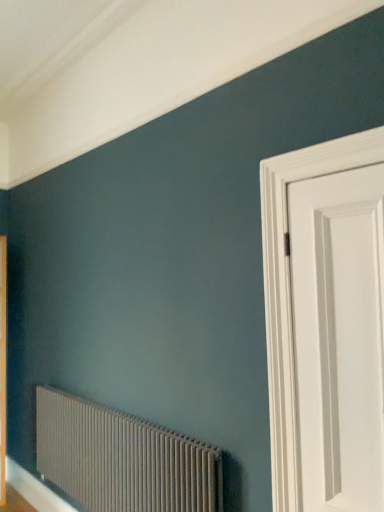
At what (x,y) coordinates should I click in order to perform the action: click on matte gray radiator at lower left. Please return your answer as a coordinate pair (x, y). Image resolution: width=384 pixels, height=512 pixels. Looking at the image, I should click on (122, 459).

What do you see at coordinates (122, 459) in the screenshot?
I see `matte gray radiator at lower left` at bounding box center [122, 459].

Measure the distance between matte gray radiator at lower left and camera.

matte gray radiator at lower left is 1.81 meters away from camera.

What is the approximate width of white glossy door at right?

white glossy door at right is 2.71 inches wide.

Locate an element on the screen. The height and width of the screenshot is (512, 384). white glossy door at right is located at coordinates (278, 264).

What do you see at coordinates (278, 264) in the screenshot? I see `white glossy door at right` at bounding box center [278, 264].

The height and width of the screenshot is (512, 384). In order to click on matte gray radiator at lower left in this screenshot , I will do `click(122, 459)`.

Based on their positions, is matte gray radiator at lower left located to the left or right of white glossy door at right?

matte gray radiator at lower left is to the left of white glossy door at right.

Considering the positions of objects matte gray radiator at lower left and white glossy door at right in the image provided, who is behind, matte gray radiator at lower left or white glossy door at right?

Positioned behind is matte gray radiator at lower left.

Considering the positions of points (115, 498) and (269, 176), is point (115, 498) closer to camera compared to point (269, 176)?

No, (115, 498) is further to viewer.

From the image's perspective, is matte gray radiator at lower left located beneath white glossy door at right?

Correct, matte gray radiator at lower left appears lower than white glossy door at right in the image.

From a real-world perspective, is matte gray radiator at lower left physically located above or below white glossy door at right?

From a real-world perspective, matte gray radiator at lower left is physically below white glossy door at right.

Is matte gray radiator at lower left wider or thinner than white glossy door at right?

Considering their sizes, matte gray radiator at lower left looks broader than white glossy door at right.

Which of these two, matte gray radiator at lower left or white glossy door at right, stands shorter?

matte gray radiator at lower left is shorter.

Between matte gray radiator at lower left and white glossy door at right, which one has larger size?

matte gray radiator at lower left.

Is white glossy door at right surrounded by matte gray radiator at lower left?

No, white glossy door at right is located outside of matte gray radiator at lower left.

In the scene shown: Would you consider matte gray radiator at lower left to be distant from white glossy door at right?

Absolutely, matte gray radiator at lower left is distant from white glossy door at right.

Is matte gray radiator at lower left looking in the opposite direction of white glossy door at right?

No, matte gray radiator at lower left is not facing away from white glossy door at right.

You are a GUI agent. You are given a task and a screenshot of the screen. Output one action in this format:
    pyautogui.click(x=<x>, y=<y>)
    Task: Click on the radiator behind the white glossy door at right
    The height and width of the screenshot is (512, 384).
    Given the screenshot: What is the action you would take?
    pyautogui.click(x=122, y=459)

Between white glossy door at right and matte gray radiator at lower left, which one appears on the left side from the viewer's perspective?

matte gray radiator at lower left.

Is white glossy door at right positioned behind matte gray radiator at lower left?

No.

Does point (324, 173) come farther from viewer compared to point (55, 454)?

No, it is in front of (55, 454).

From the image's perspective, is white glossy door at right below matte gray radiator at lower left?

Actually, white glossy door at right appears above matte gray radiator at lower left in the image.

From a real-world perspective, relative to matte gray radiator at lower left, is white glossy door at right vertically above or below?

In terms of real-world spatial position, white glossy door at right is above matte gray radiator at lower left.

Is white glossy door at right thinner than matte gray radiator at lower left?

Yes.

Is white glossy door at right taller than matte gray radiator at lower left?

Yes, white glossy door at right is taller than matte gray radiator at lower left.

Between white glossy door at right and matte gray radiator at lower left, which one has larger size?

matte gray radiator at lower left is bigger.

Is white glossy door at right spatially inside matte gray radiator at lower left, or outside of it?

white glossy door at right is not enclosed by matte gray radiator at lower left.

Is white glossy door at right next to matte gray radiator at lower left?

No, white glossy door at right is not next to matte gray radiator at lower left.

Could you tell me if white glossy door at right is turned towards matte gray radiator at lower left?

No.

What's the angular difference between white glossy door at right and matte gray radiator at lower left's facing directions?

There is a 0.254-degree angle between the facing directions of white glossy door at right and matte gray radiator at lower left.

Where is `door that is in front of the matte gray radiator at lower left`? door that is in front of the matte gray radiator at lower left is located at coordinates (278, 264).

This screenshot has width=384, height=512. Identify the location of radiator behind the white glossy door at right. pyautogui.click(x=122, y=459).

This screenshot has height=512, width=384. Find the location of `radiator below the white glossy door at right (from a real-world perspective)`. radiator below the white glossy door at right (from a real-world perspective) is located at coordinates point(122,459).